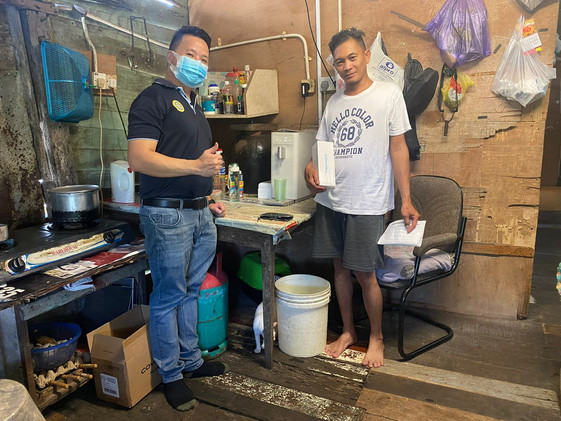
Identify the location of chair leg. The width and height of the screenshot is (561, 421). (399, 309).